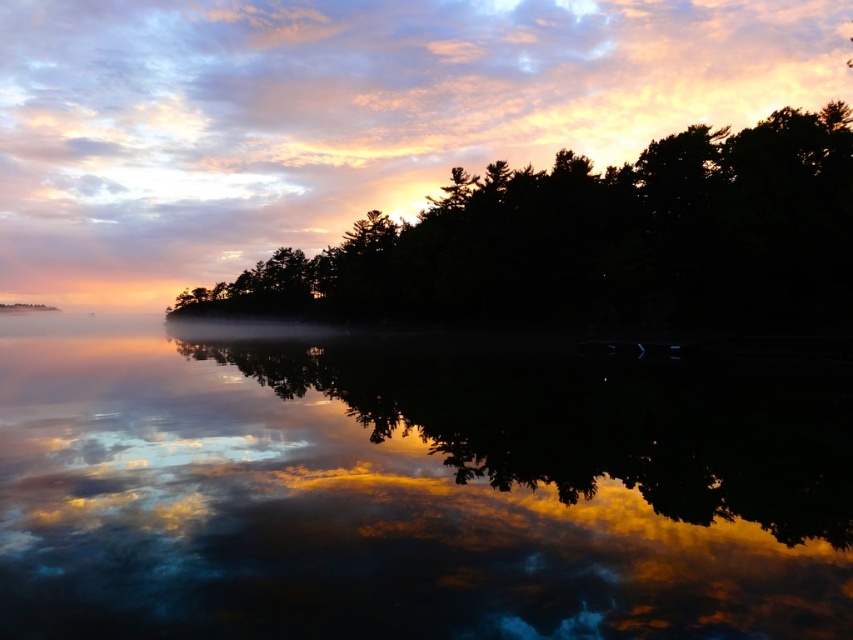
Consider the image. You are an artist trying to paint the scene. You need to decide which object, the glossy reflective water at center or the silhouette tree at center, requires more space on your canvas. Based on the scene description, which one should you allocate more canvas space to?

The silhouette tree at center requires more canvas space because the glossy reflective water at center has a lesser width compared to it.